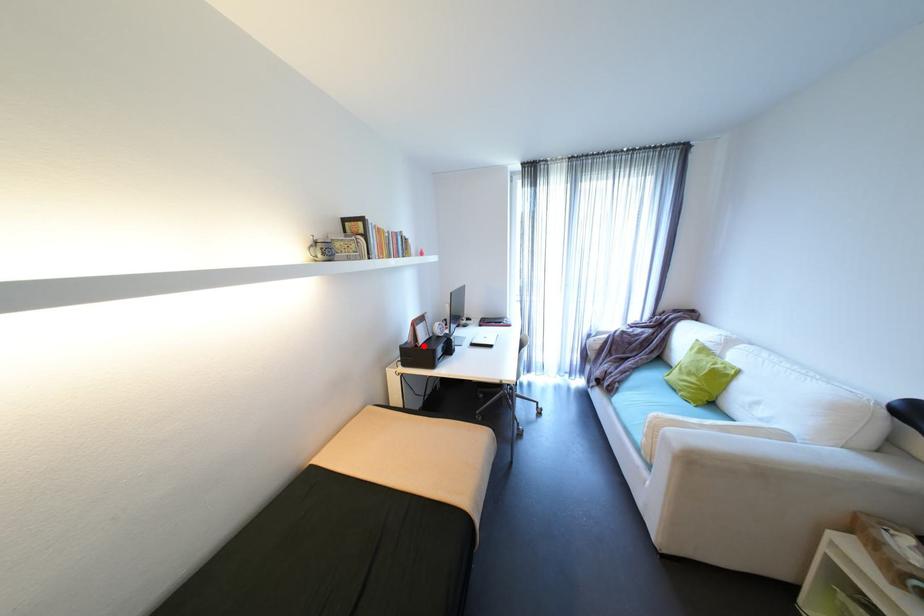
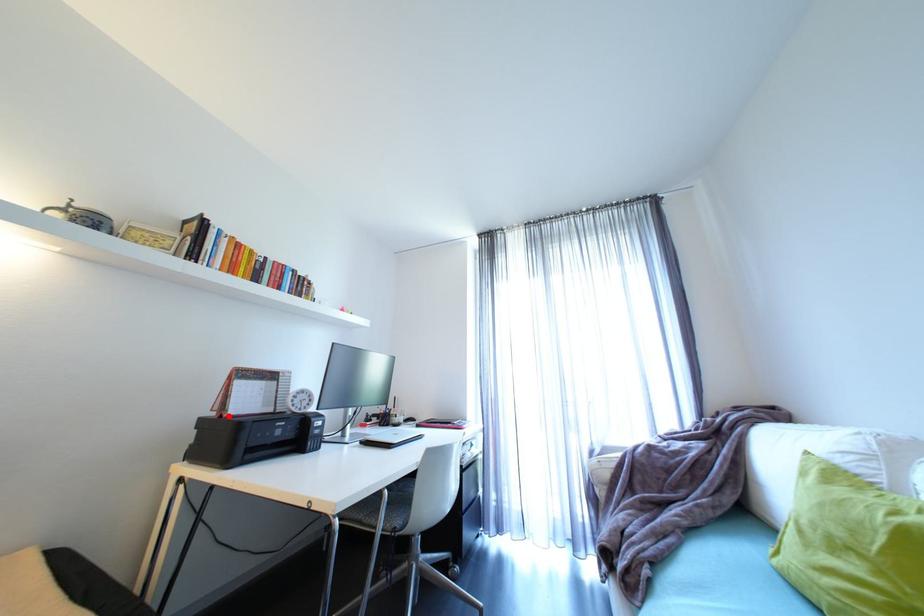
I am providing you with two images of the same scene from different viewpoints. A red point is marked on the first image and another point is marked on the second image. Is the marked point in image1 the same physical position as the marked point in image2?

Yes